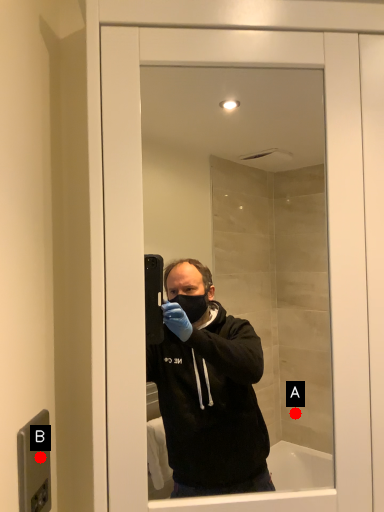
Question: Two points are circled on the image, labeled by A and B beside each circle. Which point is farther from the camera taking this photo?

Choices:
 (A) A is further
 (B) B is further

Answer: (A)